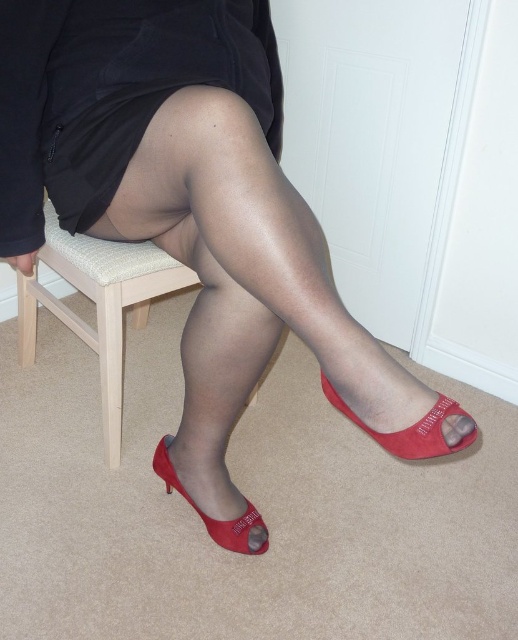
Is black sheer dress at center closer to camera compared to matte red peep-toe shoe at lower center?

Yes, black sheer dress at center is closer to the viewer.

Locate an element on the screen. The image size is (518, 640). black sheer dress at center is located at coordinates (111, 93).

Who is more distant from viewer, (39, 218) or (178, 481)?

Positioned behind is point (178, 481).

Identify the location of black sheer dress at center. This screenshot has width=518, height=640. (111, 93).

Does black sheer dress at center have a smaller size compared to matte red high-heeled shoe at lower right?

Actually, black sheer dress at center might be larger than matte red high-heeled shoe at lower right.

Is black sheer dress at center bigger than matte red high-heeled shoe at lower right?

Yes.

Who is more distant from viewer, (70, 134) or (436, 449)?

Point (70, 134)

The height and width of the screenshot is (640, 518). I want to click on black sheer dress at center, so click(x=111, y=93).

This screenshot has width=518, height=640. What do you see at coordinates (111, 93) in the screenshot?
I see `black sheer dress at center` at bounding box center [111, 93].

Between black sheer dress at center and transparent nylon sock at lower center, which one has less height?

Standing shorter between the two is transparent nylon sock at lower center.

Which is behind, point (88, 19) or point (171, 467)?

The point (171, 467) is more distant.

Find the location of `black sheer dress at center`. black sheer dress at center is located at coordinates (111, 93).